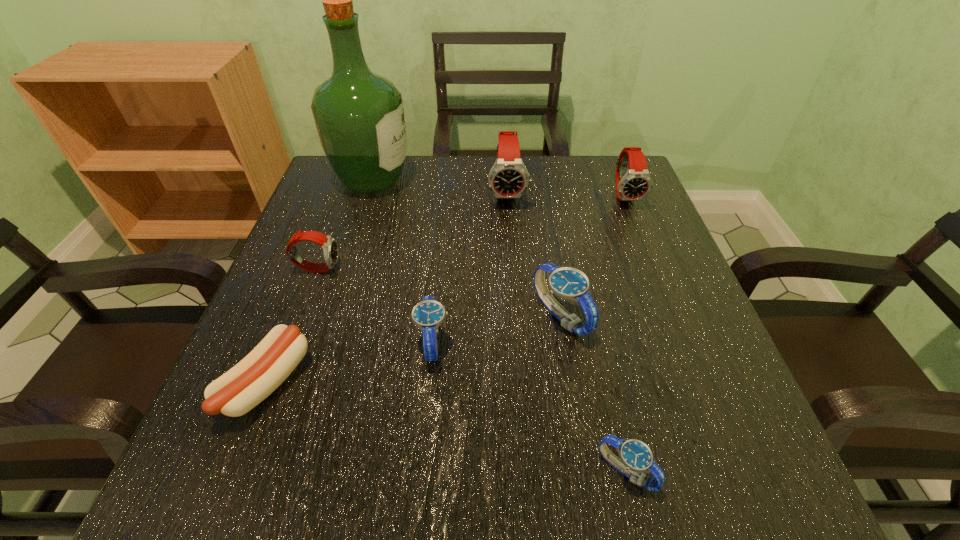
Locate an element on the screen. the leftmost blue watch is located at coordinates (428, 314).

Where is `sausage`? This screenshot has height=540, width=960. sausage is located at coordinates (236, 392).

Where is `the nearest blue watch`? The height and width of the screenshot is (540, 960). the nearest blue watch is located at coordinates (x=636, y=457).

Identify the location of the shortest watch. (x=636, y=457).

Where is `vacant area situated on the front-facing side of the liquor`? vacant area situated on the front-facing side of the liquor is located at coordinates (553, 179).

You are a GUI agent. You are given a task and a screenshot of the screen. Output one action in this format:
    pyautogui.click(x=<x>, y=<y>)
    Task: Click on the vacant area situated 0.370m on the face of the tallest watch
    This screenshot has width=960, height=540.
    Given the screenshot: What is the action you would take?
    pyautogui.click(x=518, y=337)

You are a GUI agent. You are given a task and a screenshot of the screen. Output one action in this format:
    pyautogui.click(x=<x>, y=<y>)
    Task: Click on the vacant region located on the face of the second biggest red watch
    
    Given the screenshot: What is the action you would take?
    pyautogui.click(x=639, y=232)

Locate an element on the screen. The height and width of the screenshot is (540, 960). free region located 0.050m on the right of the biggest blue watch is located at coordinates (616, 316).

You are a GUI agent. You are given a task and a screenshot of the screen. Output one action in this format:
    pyautogui.click(x=<x>, y=<y>)
    Task: Click on the vacant area located on the face of the fourth nearest watch
    
    Given the screenshot: What is the action you would take?
    pyautogui.click(x=374, y=268)

I want to click on vacant position located 0.240m on the right of the second watch from left to right, so click(x=588, y=341).